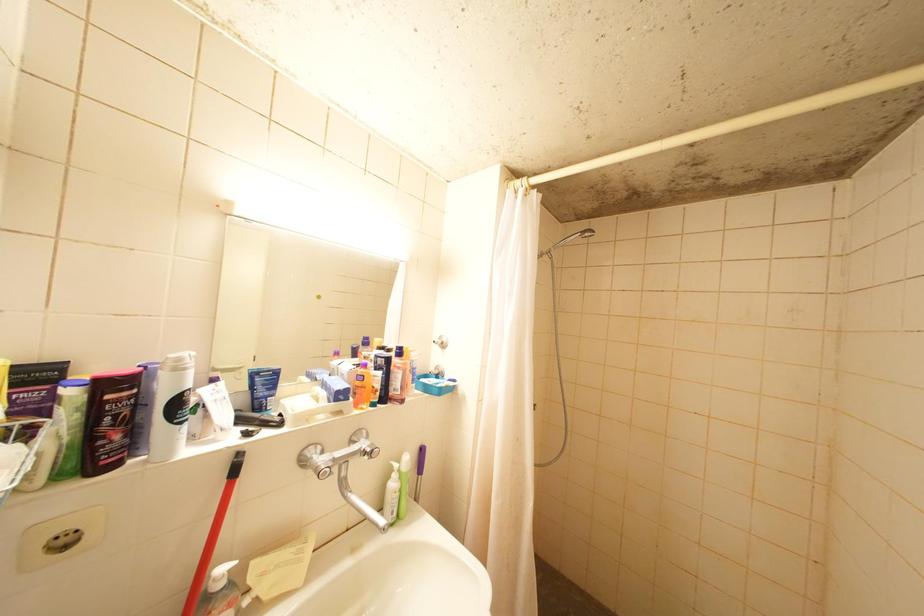
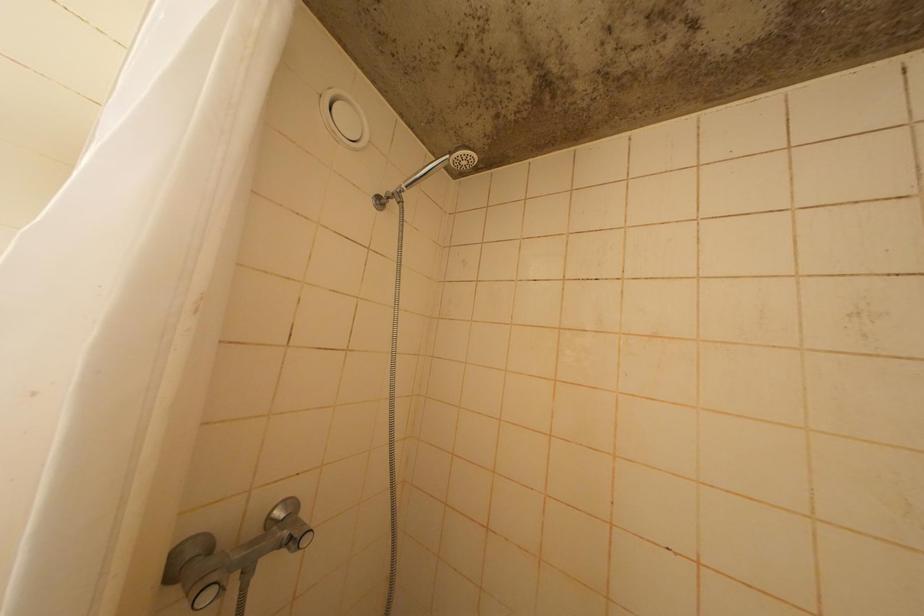
Which direction would the cameraman need to move to produce the second image?

The cameraman walked toward right, forward.